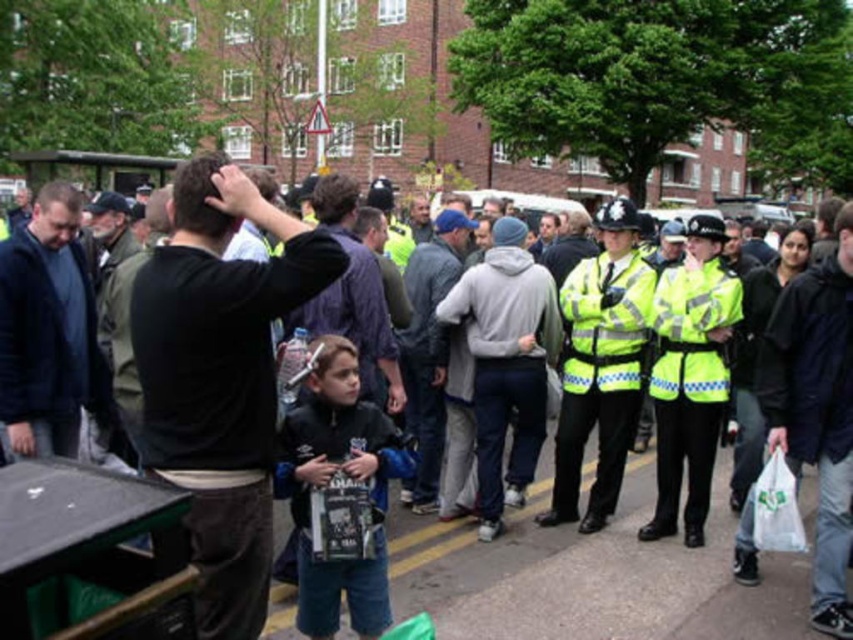
Please look at the image and tell me what object is located at the coordinates point (47, 332). The scene has a crowd of people near a brick building with trees in front of it. The objects in the image include a dark blue jacket at left. Please answer based on the description provided.

The object at point (47, 332) is the dark blue jacket at left.

You are a photographer trying to capture a clear shot of both the black cotton shirt at center and the dark gray jacket at center. Since you want to ensure both are visible in the frame, which object should you focus on first to account for their sizes?

You should focus on the black cotton shirt at center first because it is larger than the dark gray jacket at center, ensuring it fills the frame appropriately before adjusting for the smaller object.